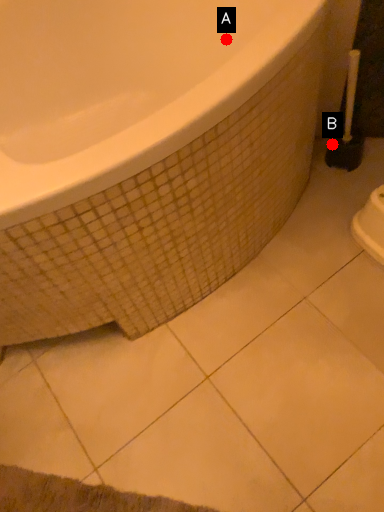
Question: Two points are circled on the image, labeled by A and B beside each circle. Which point is closer to the camera?

Choices:
 (A) A is closer
 (B) B is closer

Answer: (A)